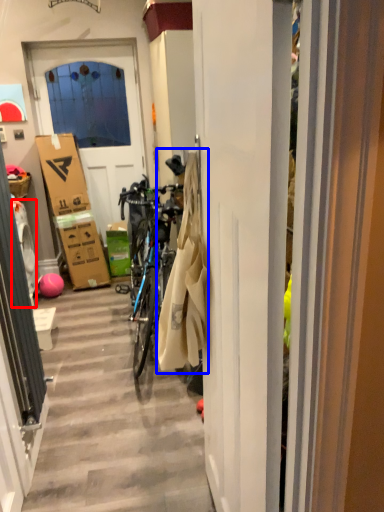
Question: Which of the following is the farthest to the observer, washing machine (highlighted by a red box) or laundry (highlighted by a blue box)?

Choices:
 (A) washing machine
 (B) laundry

Answer: (A)